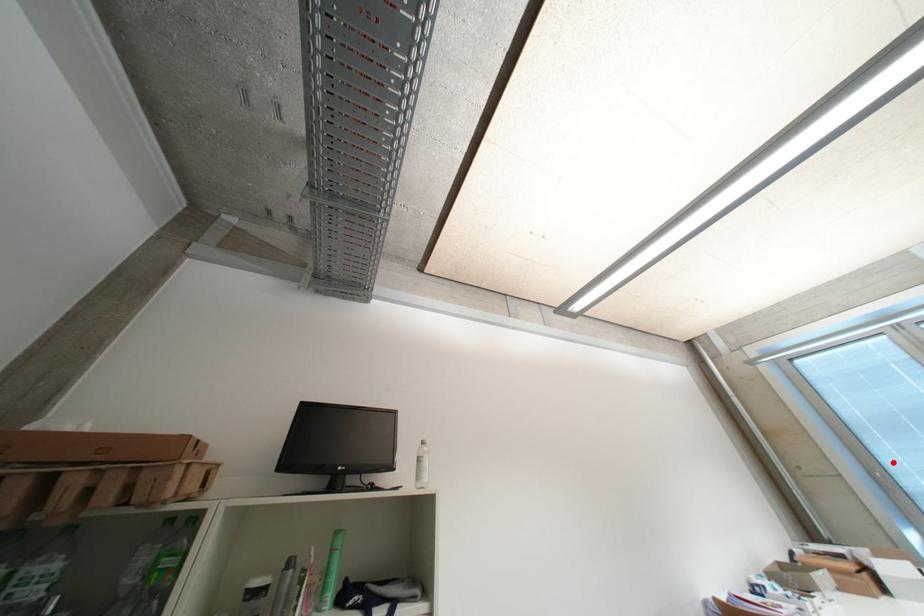
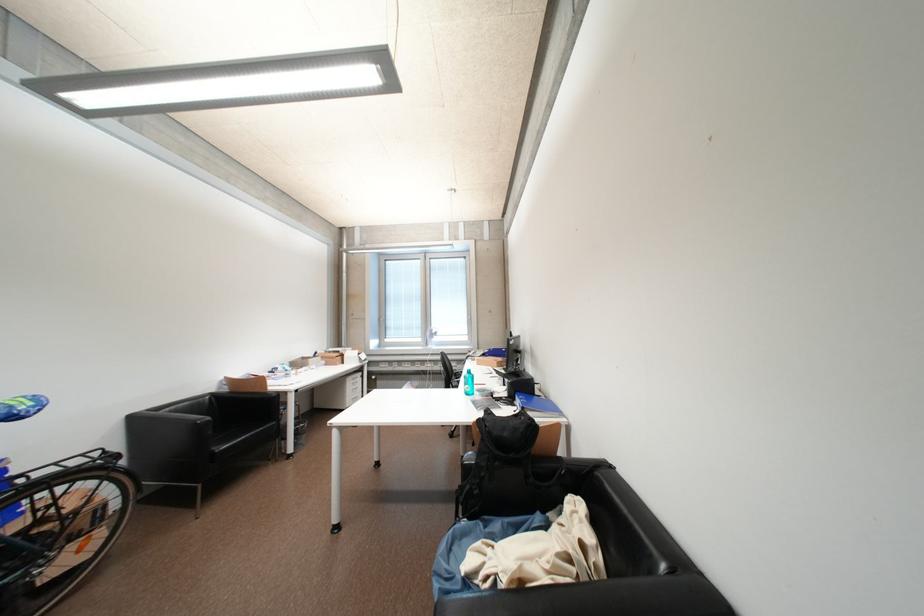
Question: I am providing you with two images of the same scene from different viewpoints. A red point is marked on the first image. Can you still see the location of the red point in image 2?

Choices:
 (A) Yes
 (B) No

Answer: (A)